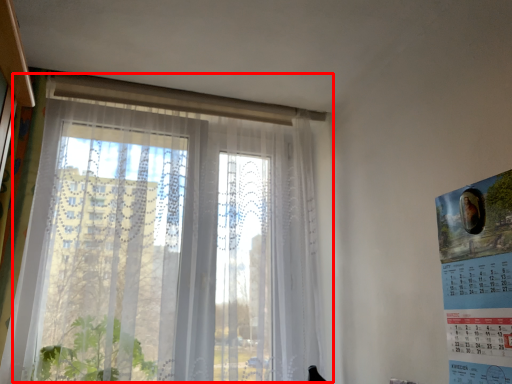
Question: From the image's perspective, what is the correct spatial positioning of window (annotated by the red box) in reference to poster page?

Choices:
 (A) above
 (B) below

Answer: (A)